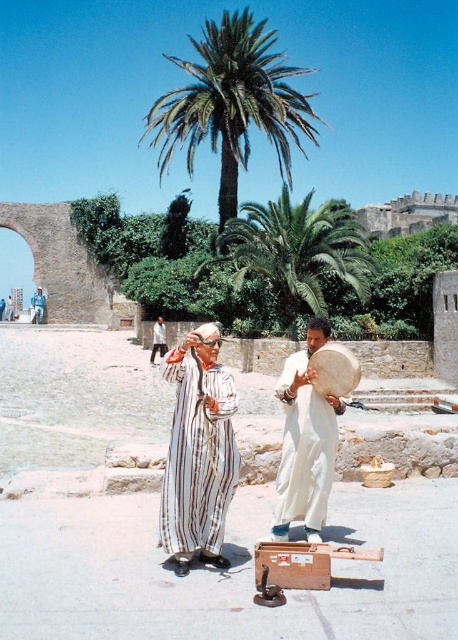
You are standing at the point labeled as point (174, 426) in the image. If you want to move 5 meters towards the direction of the snake charmer, will you be able to reach the snake charmer?

The distance between the point (174, 426) and the viewer is 8.43 meters. Moving 5 meters towards the snake charmer from the point would leave you 3.43 meters away from the viewer, so yes, you can reach the snake charmer.

You are standing on the street and want to take a photo of the green leafy palm tree at upper center. Where should you look to capture it in your camera viewfinder?

You should look towards the upper center at point coordinates approximately 0.163 on the x axis and 0.507 on the y axis to capture the green leafy palm tree at upper center in your camera viewfinder.

You are a tourist standing in front of the performers and want to take a photo of the green leafy palm tree at upper center and the white striped robe at center. To get both in the frame, should you pan your camera to the left or right?

The green leafy palm tree at upper center is to the right of the white striped robe at center, so to include both in the frame, you should pan your camera to the right.